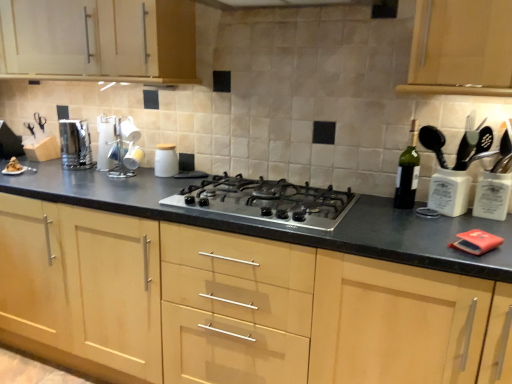
Question: Does satin silver gas stove at center have a lesser width compared to green glass bottle at right?

Choices:
 (A) yes
 (B) no

Answer: (B)

Question: Does satin silver gas stove at center have a smaller size compared to green glass bottle at right?

Choices:
 (A) no
 (B) yes

Answer: (A)

Question: From the image's perspective, is satin silver gas stove at center located beneath green glass bottle at right?

Choices:
 (A) no
 (B) yes

Answer: (B)

Question: Is satin silver gas stove at center closer to the viewer compared to green glass bottle at right?

Choices:
 (A) no
 (B) yes

Answer: (B)

Question: Is satin silver gas stove at center at the right side of green glass bottle at right?

Choices:
 (A) yes
 (B) no

Answer: (B)

Question: Considering their positions, is matte wood cabinet at upper left, which ranks as the 2th cabinetry in bottom-to-top order, located in front of or behind green glass bottle at right?

Choices:
 (A) behind
 (B) front

Answer: (A)

Question: From a real-world perspective, is matte wood cabinet at upper left, which appears as the 1th cabinetry when viewed from the top, positioned above or below green glass bottle at right?

Choices:
 (A) above
 (B) below

Answer: (A)

Question: From the image's perspective, is matte wood cabinet at upper left, which appears as the 1th cabinetry when viewed from the top, positioned above or below green glass bottle at right?

Choices:
 (A) above
 (B) below

Answer: (A)

Question: In the image, is matte wood cabinet at upper left, which appears as the 1th cabinetry when viewed from the top, on the left side or the right side of green glass bottle at right?

Choices:
 (A) left
 (B) right

Answer: (A)

Question: Relative to satin silver gas stove at center, is light wood cabinet at center, marked as the first cabinetry in a bottom-to-top arrangement, in front or behind?

Choices:
 (A) behind
 (B) front

Answer: (B)

Question: Is point (274, 314) closer or farther from the camera than point (287, 215)?

Choices:
 (A) farther
 (B) closer

Answer: (B)

Question: Considering the positions of light wood cabinet at center, which is the 2th cabinetry in top-to-bottom order, and satin silver gas stove at center in the image, is light wood cabinet at center, which is the 2th cabinetry in top-to-bottom order, taller or shorter than satin silver gas stove at center?

Choices:
 (A) short
 (B) tall

Answer: (B)

Question: Is light wood cabinet at center, marked as the first cabinetry in a bottom-to-top arrangement, bigger or smaller than satin silver gas stove at center?

Choices:
 (A) small
 (B) big

Answer: (B)

Question: In terms of size, does polished stainless steel toaster at left, positioned as the first kitchen appliance in left-to-right order, appear bigger or smaller than white ceramic jar at center, the second kitchen appliance from the left?

Choices:
 (A) small
 (B) big

Answer: (B)

Question: Is polished stainless steel toaster at left, the 2th kitchen appliance when ordered from right to left, wider or thinner than white ceramic jar at center, the first kitchen appliance from the right?

Choices:
 (A) thin
 (B) wide

Answer: (B)